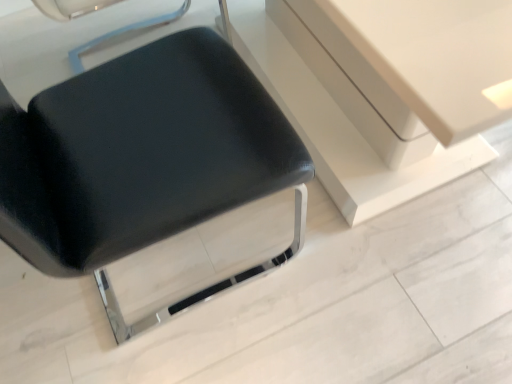
Question: Is matte black vanity at center turned away from black leather chair at center?

Choices:
 (A) no
 (B) yes

Answer: (B)

Question: From the image's perspective, is matte black vanity at center over black leather chair at center?

Choices:
 (A) yes
 (B) no

Answer: (A)

Question: Would you say black leather chair at center is part of matte black vanity at center's contents?

Choices:
 (A) yes
 (B) no

Answer: (B)

Question: From the image's perspective, is matte black vanity at center below black leather chair at center?

Choices:
 (A) no
 (B) yes

Answer: (A)

Question: Can you confirm if matte black vanity at center is bigger than black leather chair at center?

Choices:
 (A) no
 (B) yes

Answer: (B)

Question: Can you confirm if matte black vanity at center is thinner than black leather chair at center?

Choices:
 (A) no
 (B) yes

Answer: (A)

Question: From the image's perspective, would you say black leather chair at center is shown under matte black vanity at center?

Choices:
 (A) no
 (B) yes

Answer: (B)

Question: From a real-world perspective, does black leather chair at center sit lower than matte black vanity at center?

Choices:
 (A) no
 (B) yes

Answer: (A)

Question: Does black leather chair at center come in front of matte black vanity at center?

Choices:
 (A) no
 (B) yes

Answer: (B)

Question: Considering the relative sizes of black leather chair at center and matte black vanity at center in the image provided, is black leather chair at center taller than matte black vanity at center?

Choices:
 (A) yes
 (B) no

Answer: (A)

Question: Is black leather chair at center wider than matte black vanity at center?

Choices:
 (A) yes
 (B) no

Answer: (B)

Question: Considering the relative sizes of black leather chair at center and matte black vanity at center in the image provided, is black leather chair at center smaller than matte black vanity at center?

Choices:
 (A) no
 (B) yes

Answer: (B)

Question: Would you say matte black vanity at center is to the left or to the right of black leather chair at center in the picture?

Choices:
 (A) right
 (B) left

Answer: (A)